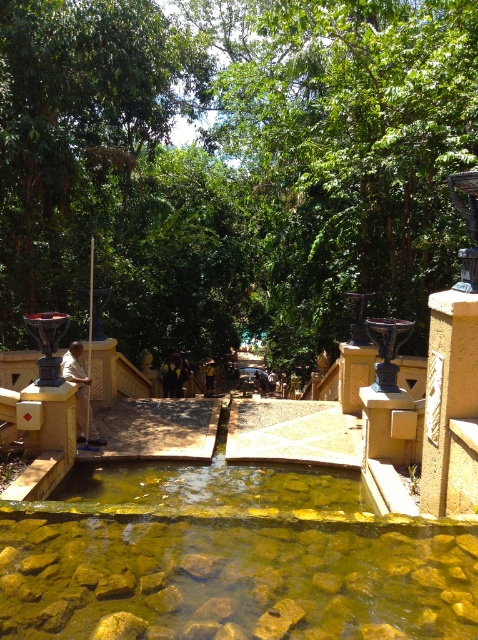
Between point (434, 32) and point (251, 520), which one is positioned in front?

Point (251, 520) is in front.

Find the location of `green leafy tree at center`. green leafy tree at center is located at coordinates (232, 166).